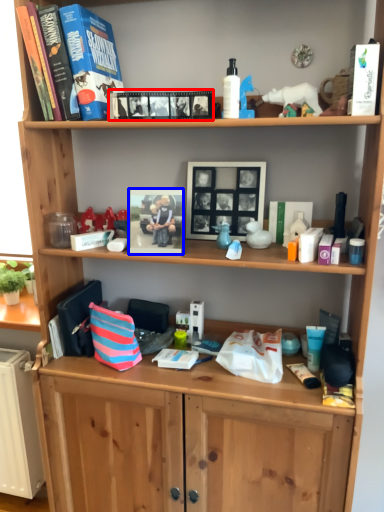
Question: Among these objects, which one is nearest to the camera, book (highlighted by a red box) or picture frame (highlighted by a blue box)?

Choices:
 (A) book
 (B) picture frame

Answer: (A)